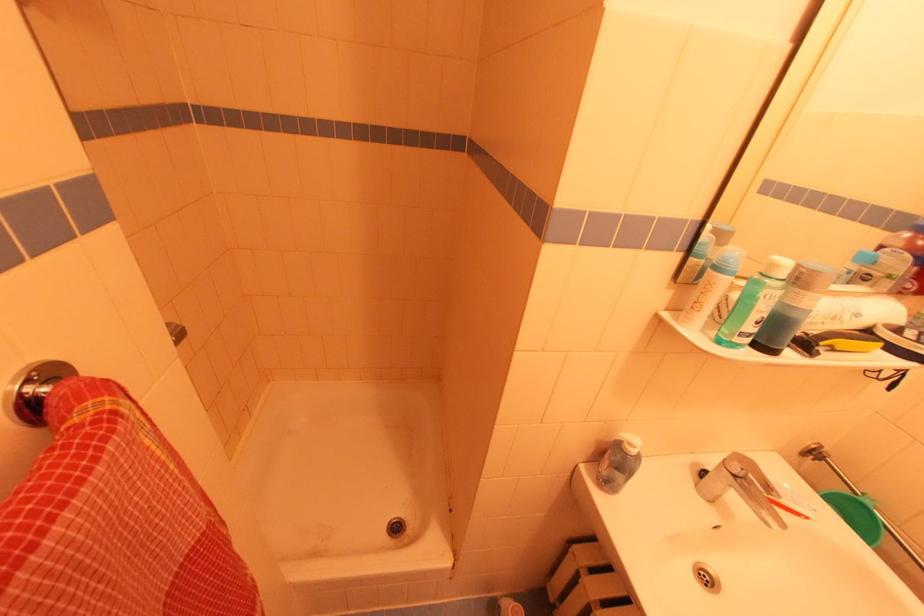
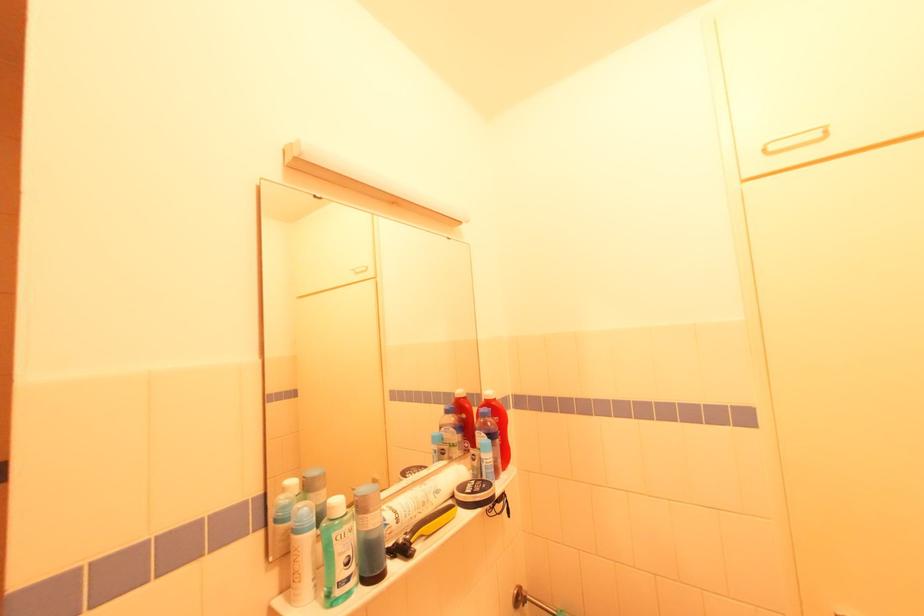
Find the pixel in the second image that matches [856,318] in the first image.

(438, 496)